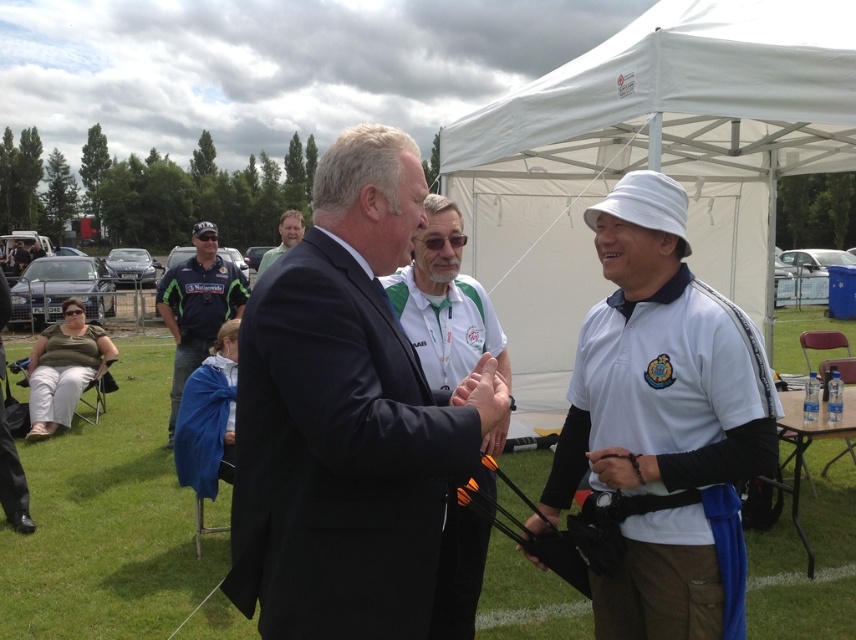
Between point (345, 451) and point (289, 216), which one is positioned behind?

The point (289, 216) is behind.

Is black suit at center below green fabric shirt at upper center?

Correct, black suit at center is located below green fabric shirt at upper center.

What do you see at coordinates (351, 424) in the screenshot? This screenshot has height=640, width=856. I see `black suit at center` at bounding box center [351, 424].

In order to click on black suit at center in this screenshot , I will do `click(351, 424)`.

Is point (744, 401) in front of point (173, 264)?

Yes, it is in front of point (173, 264).

What are the coordinates of `white matte hat at center` in the screenshot? It's located at (663, 422).

Who is lower down, white matte hat at center or dark suit at center?

white matte hat at center is lower down.

Image resolution: width=856 pixels, height=640 pixels. I want to click on white matte hat at center, so click(x=663, y=422).